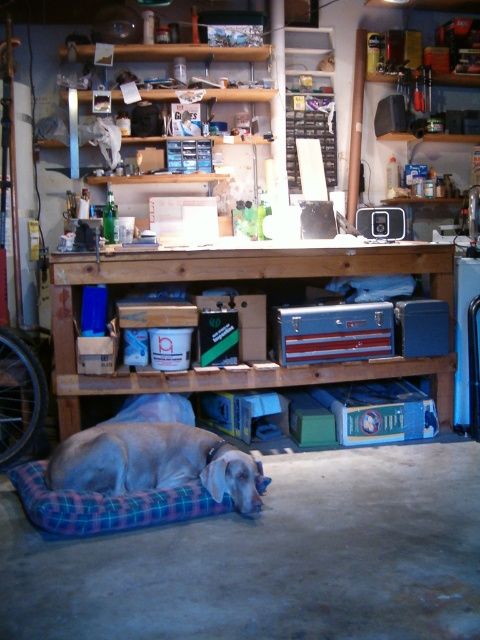
You are organizing the workshop and need to place a new item on the shelf above the workbench. The shelf has limited space. Can you determine if the metallic silver toolbox at center will fit on the shelf based on its current position?

The metallic silver toolbox at center is located at point 0.492, so it can fit on the shelf above the workbench.

You are organizing the workshop and need to place a new item on the shelf above the workbench. Which object, the metallic silver toolbox at center or the plaid fabric dog bed at lower center, is taller and should be placed on the higher shelf to avoid blocking the view of the items below?

The metallic silver toolbox at center is much taller than the plaid fabric dog bed at lower center, so it should be placed on the higher shelf to avoid blocking the view of the items below.